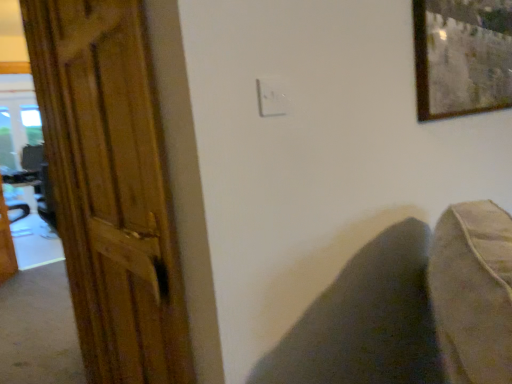
This screenshot has width=512, height=384. Identify the location of wooden-framed artwork at upper right. (462, 57).

Where is `wooden door at left`? wooden door at left is located at coordinates (110, 188).

The height and width of the screenshot is (384, 512). What do you see at coordinates (110, 188) in the screenshot?
I see `wooden door at left` at bounding box center [110, 188].

What are the coordinates of `white plastic electric outlet at center` in the screenshot? It's located at [273, 97].

Is white plastic electric outlet at center facing away from dark fabric swivel chair at lower right?

That's not correct — white plastic electric outlet at center is not looking away from dark fabric swivel chair at lower right.

Does white plastic electric outlet at center lie behind dark fabric swivel chair at lower right?

No, white plastic electric outlet at center is closer to the camera.

Where is `electric outlet located on the left of dark fabric swivel chair at lower right`? The image size is (512, 384). electric outlet located on the left of dark fabric swivel chair at lower right is located at coordinates (273, 97).

What's the angular difference between wooden table at left and white plastic electric outlet at center's facing directions?

4.68 degrees separate the facing orientations of wooden table at left and white plastic electric outlet at center.

This screenshot has height=384, width=512. Identify the location of table that appears on the left of white plastic electric outlet at center. (37, 191).

Is wooden table at left smaller than white plastic electric outlet at center?

No, wooden table at left is not smaller than white plastic electric outlet at center.

Between wooden table at left and white plastic electric outlet at center, which one has more height?

With more height is wooden table at left.

Where is `door in front of the wooden-framed artwork at upper right`? door in front of the wooden-framed artwork at upper right is located at coordinates (110, 188).

Considering the positions of objects wooden-framed artwork at upper right and wooden door at left in the image provided, who is behind, wooden-framed artwork at upper right or wooden door at left?

Positioned behind is wooden-framed artwork at upper right.

Which object is thinner, wooden-framed artwork at upper right or wooden door at left?

Thinner between the two is wooden door at left.

Is point (464, 4) more distant than point (153, 255)?

Yes, point (464, 4) is farther from viewer.

Does wooden table at left have a lesser width compared to wooden door at left?

No.

Is wooden table at left with wooden door at left?

No.

From the image's perspective, is wooden table at left over wooden door at left?

No, from the image's perspective, wooden table at left is not above wooden door at left.

Is the depth of wooden door at left greater than that of dark fabric swivel chair at lower right?

That is False.

Is wooden door at left oriented away from dark fabric swivel chair at lower right?

Absolutely, wooden door at left is directed away from dark fabric swivel chair at lower right.

In terms of size, does wooden door at left appear bigger or smaller than dark fabric swivel chair at lower right?

Clearly, wooden door at left is smaller in size than dark fabric swivel chair at lower right.

Would you say wooden door at left is a long distance from white plastic electric outlet at center?

wooden door at left is actually quite close to white plastic electric outlet at center.

Considering the sizes of objects wooden door at left and white plastic electric outlet at center in the image provided, who is wider, wooden door at left or white plastic electric outlet at center?

Wider between the two is white plastic electric outlet at center.

From a real-world perspective, is wooden door at left above or below white plastic electric outlet at center?

wooden door at left is below white plastic electric outlet at center.

From the image's perspective, which is above, wooden door at left or white plastic electric outlet at center?

white plastic electric outlet at center, from the image's perspective.

Is the depth of wooden table at left greater than that of dark fabric swivel chair at lower right?

Yes.

Where is `table above the dark fabric swivel chair at lower right (from a real-world perspective)`? table above the dark fabric swivel chair at lower right (from a real-world perspective) is located at coordinates pyautogui.click(x=37, y=191).

Which of these two, wooden table at left or dark fabric swivel chair at lower right, is thinner?

wooden table at left is thinner.

What are the coordinates of `swivel chair behind the white plastic electric outlet at center` in the screenshot? It's located at (410, 309).

Find the location of a particular element. This screenshot has width=512, height=384. electric outlet on the right of wooden table at left is located at coordinates (273, 97).

Estimate the real-world distances between objects in this image. Which object is further from wooden table at left, white plastic electric outlet at center or wooden door at left?

white plastic electric outlet at center is positioned further to the anchor wooden table at left.

When comparing their distances from wooden door at left, does wooden-framed artwork at upper right or wooden table at left seem further?

wooden table at left.

Which object lies nearer to the anchor point white plastic electric outlet at center, wooden door at left or wooden-framed artwork at upper right?

wooden-framed artwork at upper right is positioned closer to the anchor white plastic electric outlet at center.

When comparing their distances from dark fabric swivel chair at lower right, does white plastic electric outlet at center or wooden-framed artwork at upper right seem further?

white plastic electric outlet at center.

Looking at the image, which one is located closer to white plastic electric outlet at center, dark fabric swivel chair at lower right or wooden door at left?

dark fabric swivel chair at lower right is positioned closer to the anchor white plastic electric outlet at center.

Based on their spatial positions, is wooden table at left or wooden door at left further from white plastic electric outlet at center?

wooden table at left is further to white plastic electric outlet at center.

Considering their positions, is dark fabric swivel chair at lower right positioned further to wooden table at left than wooden door at left?

dark fabric swivel chair at lower right.

In the scene shown: From the image, which object appears to be farther from dark fabric swivel chair at lower right, wooden door at left or white plastic electric outlet at center?

wooden door at left.

This screenshot has width=512, height=384. I want to click on swivel chair between wooden door at left and wooden table at left in the front-back direction, so click(410, 309).

Identify the location of picture frame between white plastic electric outlet at center and wooden table at left along the z-axis. This screenshot has width=512, height=384. (462, 57).

At what (x,y) coordinates should I click in order to perform the action: click on swivel chair between white plastic electric outlet at center and wooden table at left along the z-axis. Please return your answer as a coordinate pair (x, y). The width and height of the screenshot is (512, 384). Looking at the image, I should click on (410, 309).

Locate an element on the screen. electric outlet between wooden-framed artwork at upper right and dark fabric swivel chair at lower right in the vertical direction is located at coordinates (273, 97).